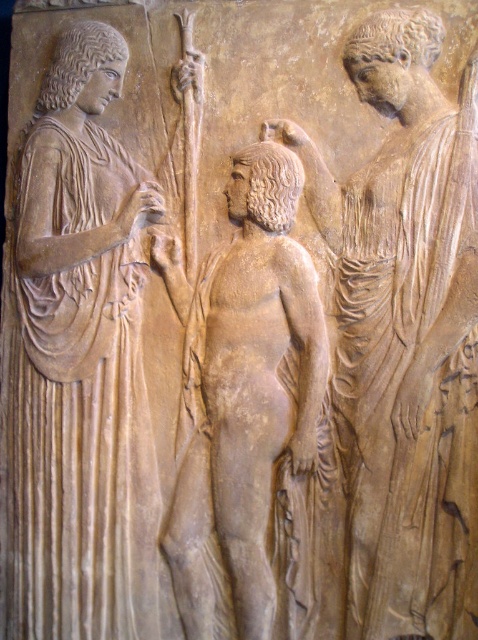
Question: Estimate the real-world distances between objects in this image. Which object is farther from the beige stone figure at center?

Choices:
 (A) matte beige robe at left
 (B) matte stone figure at center

Answer: (A)

Question: Which of the following is the closest to the observer?

Choices:
 (A) (382, 12)
 (B) (13, 435)

Answer: (A)

Question: Among these points, which one is farthest from the camera?

Choices:
 (A) (123, 444)
 (B) (449, 150)

Answer: (A)

Question: Can you confirm if matte beige robe at left is bigger than beige stone figure at center?

Choices:
 (A) yes
 (B) no

Answer: (A)

Question: Does matte beige robe at left have a lesser width compared to beige stone figure at center?

Choices:
 (A) yes
 (B) no

Answer: (B)

Question: Is matte stone figure at center above matte beige robe at left?

Choices:
 (A) no
 (B) yes

Answer: (B)